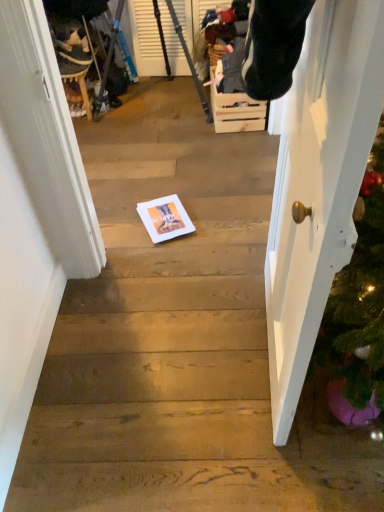
Identify the location of free space in front of white paper at center. The image size is (384, 512). (160, 246).